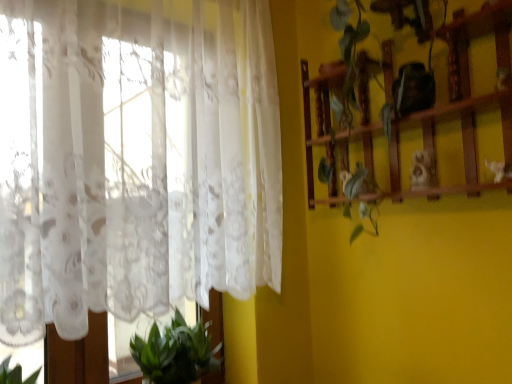
Question: Is wooden shelf at right to the left or to the right of white lace curtain at left in the image?

Choices:
 (A) right
 (B) left

Answer: (A)

Question: From the image's perspective, is wooden shelf at right located above or below white lace curtain at left?

Choices:
 (A) below
 (B) above

Answer: (B)

Question: Considering the real-world distances, which object is farthest from the white lace curtain at left?

Choices:
 (A) wooden shelf at right
 (B) green leafy plant at lower left

Answer: (A)

Question: Considering the real-world distances, which object is farthest from the white lace curtain at left?

Choices:
 (A) green leafy plant at lower left
 (B) wooden shelf at right

Answer: (B)